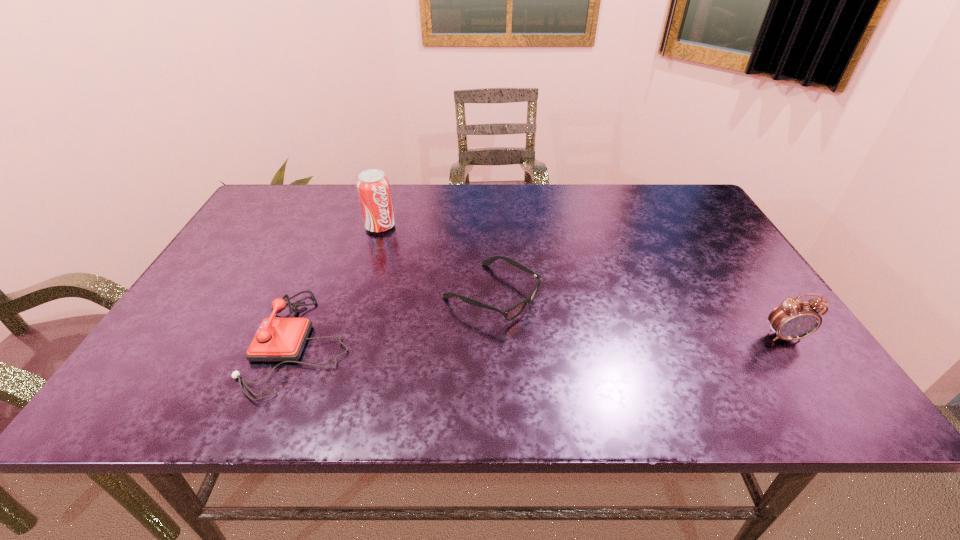
I want to click on free space between the shortest object and the telephone, so coord(396,318).

Where is `free space between the third tallest object and the third object from left to right`? Image resolution: width=960 pixels, height=540 pixels. free space between the third tallest object and the third object from left to right is located at coordinates (396, 318).

Identify the location of vacant point located between the second shortest object and the soda can. The width and height of the screenshot is (960, 540). (341, 285).

Image resolution: width=960 pixels, height=540 pixels. I want to click on empty location between the spectacles and the third shortest object, so click(x=637, y=315).

The image size is (960, 540). Find the location of `empty space that is in between the third shortest object and the farthest object`. empty space that is in between the third shortest object and the farthest object is located at coordinates (582, 282).

I want to click on free spot between the telephone and the spectacles, so click(x=396, y=318).

This screenshot has height=540, width=960. I want to click on object that stands as the second closest to the rightmost object, so [x=277, y=339].

Locate which object ranks in proximity to the soda can. Please provide its 2D coordinates. Your answer should be formatted as a tuple, i.e. [(x, y)], where the tuple contains the x and y coordinates of a point satisfying the conditions above.

[(511, 313)]

Where is `free location that satisfies the following two spatial constraints: 1. on the front side of the shortest object; 2. on the left side of the farthest object`? free location that satisfies the following two spatial constraints: 1. on the front side of the shortest object; 2. on the left side of the farthest object is located at coordinates (360, 294).